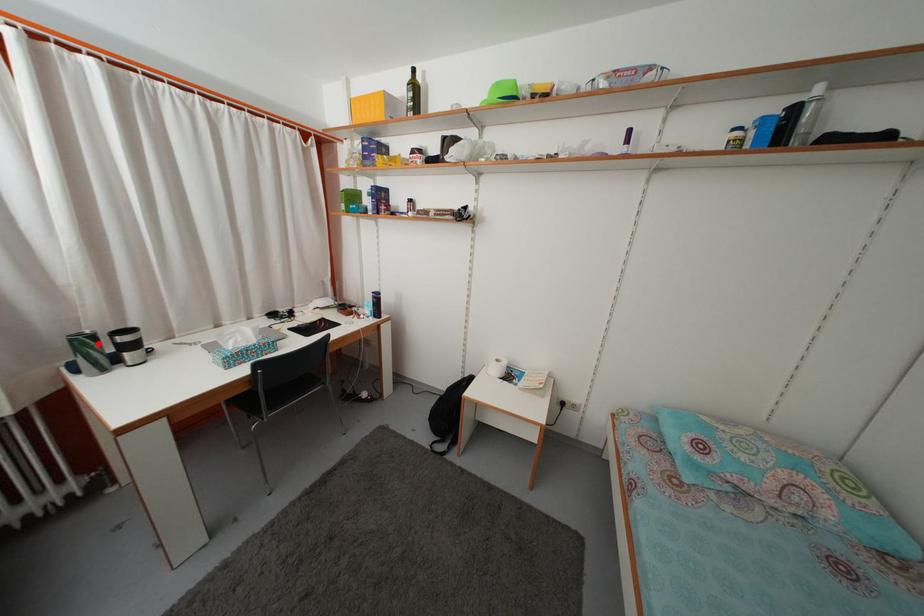
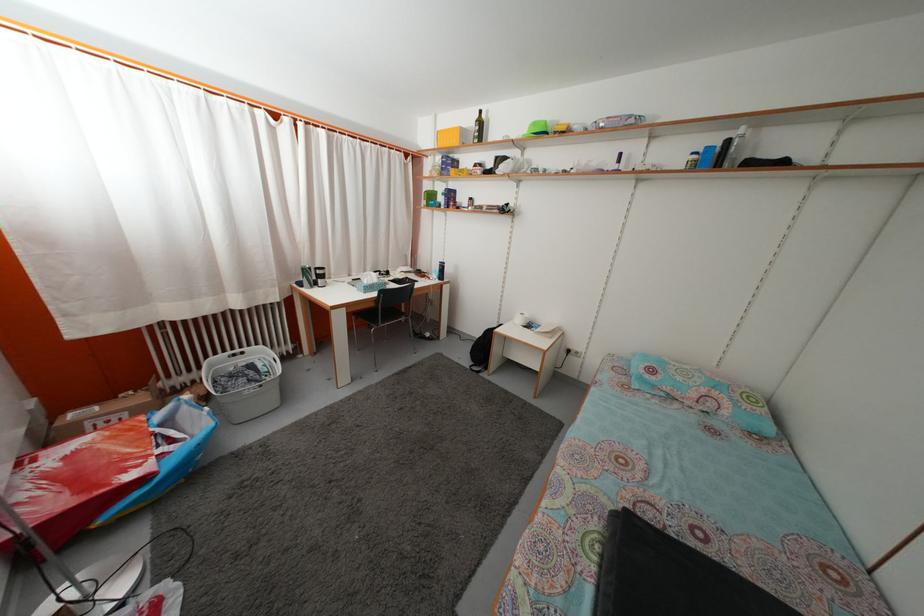
Question: A red point is marked in image1. In image2, is the corresponding 3D point closer to the camera or farther? Reply with the corresponding letter.

Choices:
 (A) The corresponding 3D point is closer.
 (B) The corresponding 3D point is farther.

Answer: (A)